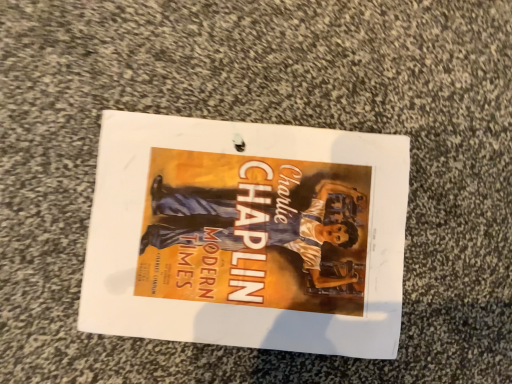
What do you see at coordinates (247, 235) in the screenshot?
I see `matte paper poster at center` at bounding box center [247, 235].

In order to click on matte paper poster at center in this screenshot , I will do `click(247, 235)`.

In order to face matte paper poster at center, should I rotate leftwards or rightwards?

It's best to rotate left around 1.026 degrees.

Where is `matte paper poster at center`? matte paper poster at center is located at coordinates point(247,235).